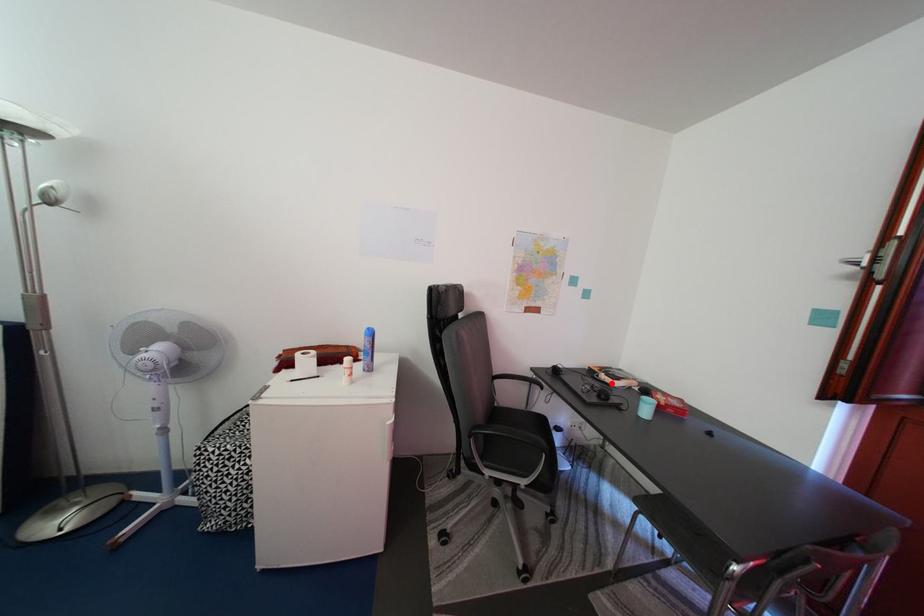
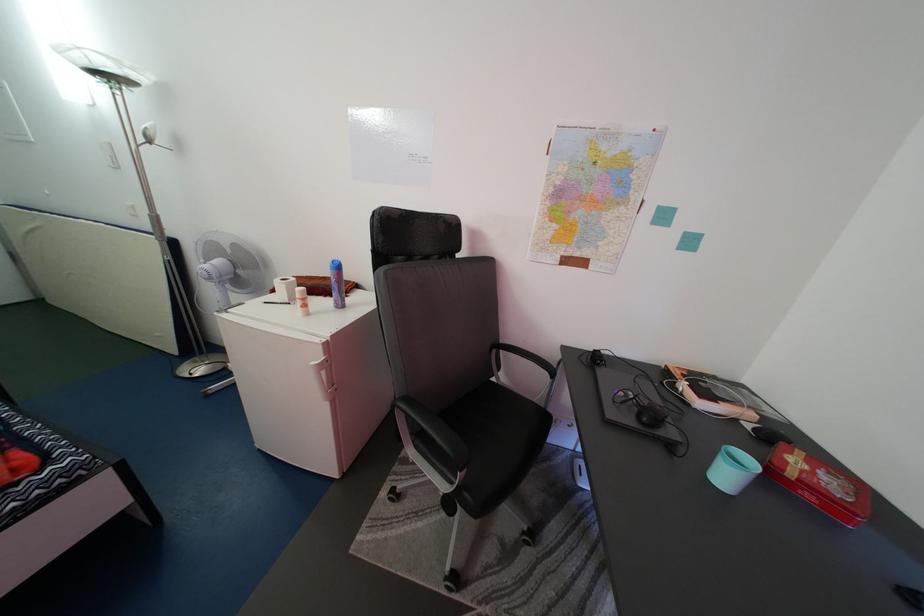
The point at the highlighted location is marked in the first image. Where is the corresponding point in the second image?

(691, 392)